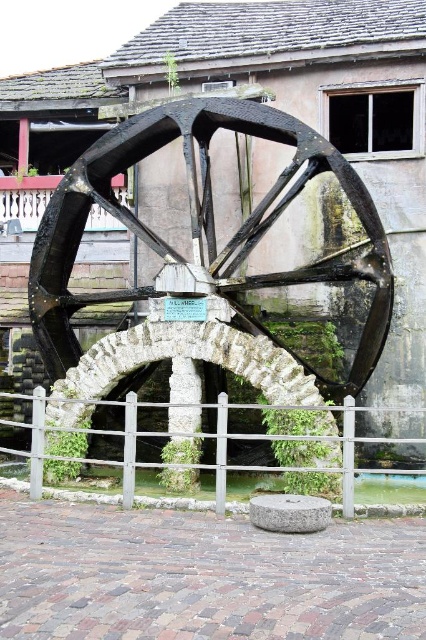
You are a maintenance worker needing to inspect the dark brown wooden wagon wheel at center and the clear water at center. Given that you can only walk 15 meters before needing to rest, will you be able to walk from one to the other without resting?

The distance between the dark brown wooden wagon wheel at center and the clear water at center is 14.98 meters, which is just under 15 meters. Therefore, you can walk from one to the other without needing to rest.

You are standing in front of the historic waterwheel scene. You notice a dark brown wooden wagon wheel at center and a clear water at center. Which object is positioned to the right side?

The dark brown wooden wagon wheel at center is to the right of clear water at center.